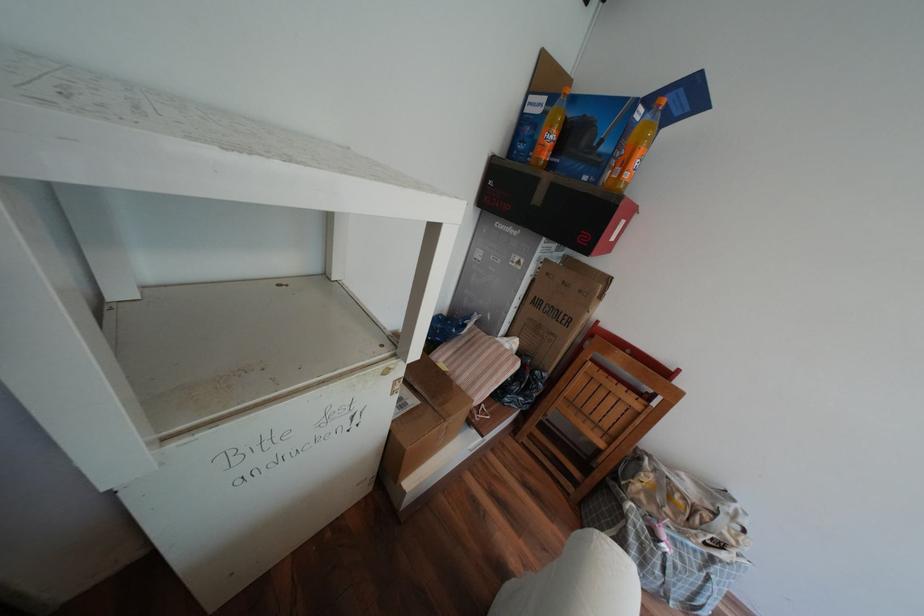
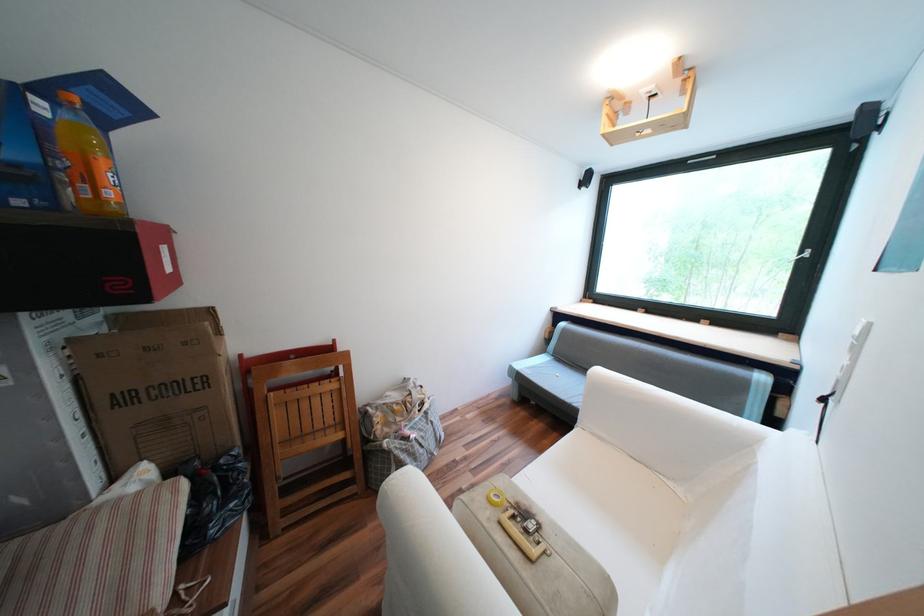
Locate, in the second image, the point that corresponds to point 635,389 in the first image.

(325, 383)